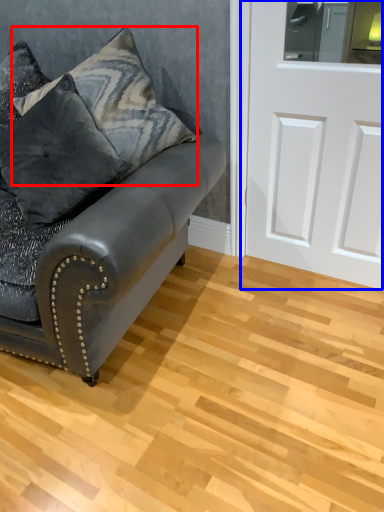
Question: Which object is closer to the camera taking this photo, pillow (highlighted by a red box) or door (highlighted by a blue box)?

Choices:
 (A) pillow
 (B) door

Answer: (B)